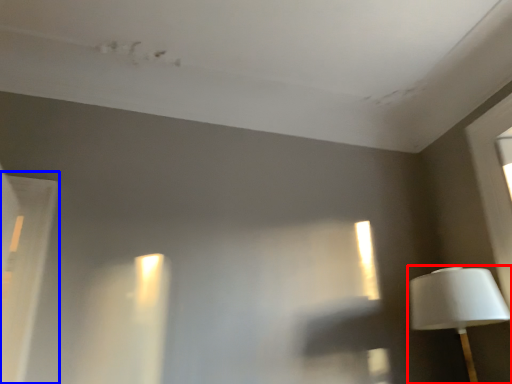
Question: Among these objects, which one is nearest to the camera, lamp (highlighted by a red box) or window (highlighted by a blue box)?

Choices:
 (A) lamp
 (B) window

Answer: (B)